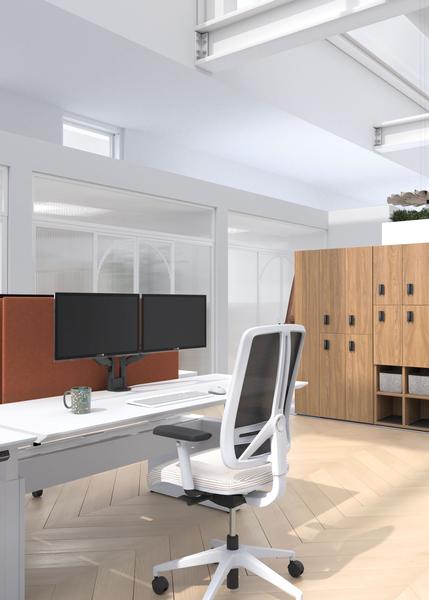
Identify the location of light. Image resolution: width=429 pixels, height=600 pixels. (57, 209), (230, 230).